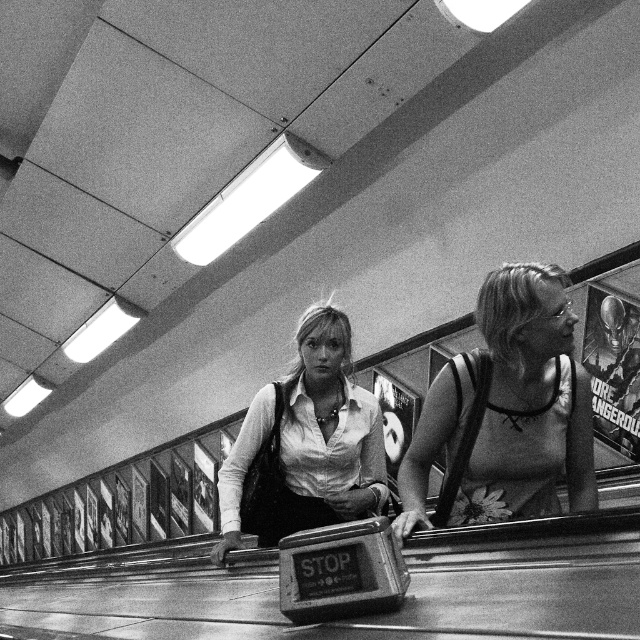
You are standing at the bottom of the escalator in the image. You see two points marked on the escalator steps. The first point is at coordinate point (576, 429) and the second is at point (273, 392). If you were to walk up the escalator, which point would you encounter first?

Point (576, 429) is in front of point (273, 392), so you would encounter point (576, 429) first as you walk up the escalator.